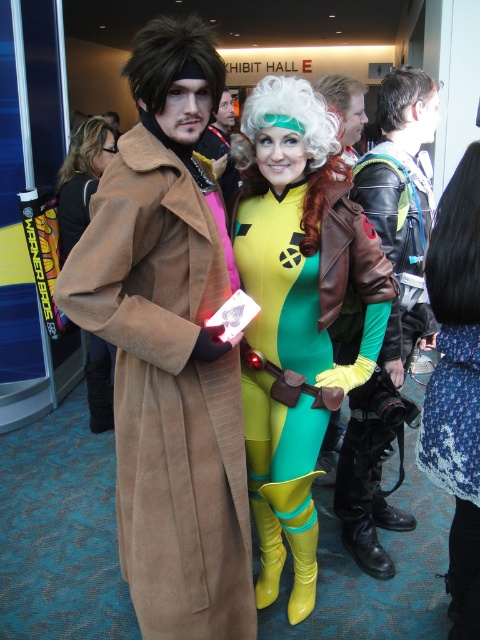
Question: Estimate the real-world distances between objects in this image. Which object is closer to the brown suede coat at center?

Choices:
 (A) shiny brown leather jacket at center
 (B) leather jacket at center

Answer: (A)

Question: Where is blonde synthetic wig at upper left located in relation to white curly wig at upper center in the image?

Choices:
 (A) below
 (B) above

Answer: (B)

Question: Considering the relative positions of blue floral skirt at lower right and white curly wig at upper right in the image provided, where is blue floral skirt at lower right located with respect to white curly wig at upper right?

Choices:
 (A) right
 (B) left

Answer: (B)

Question: Can you confirm if suede coat at left is thinner than brown synthetic wig at upper left?

Choices:
 (A) yes
 (B) no

Answer: (B)

Question: Which of these objects is positioned farthest from the white curly wig at upper right?

Choices:
 (A) brown suede coat at center
 (B) shiny brown leather jacket at center
 (C) white curly wig at upper center

Answer: (A)

Question: Which point is closer to the camera taking this photo?

Choices:
 (A) (210, 136)
 (B) (468, 317)

Answer: (B)